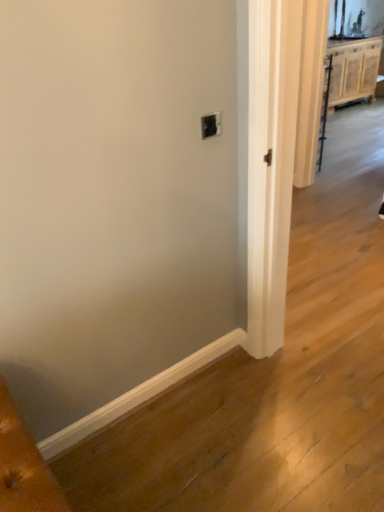
Image resolution: width=384 pixels, height=512 pixels. What are the coordinates of `vacant space in front of wooden cabinet at right` in the screenshot? It's located at (356, 122).